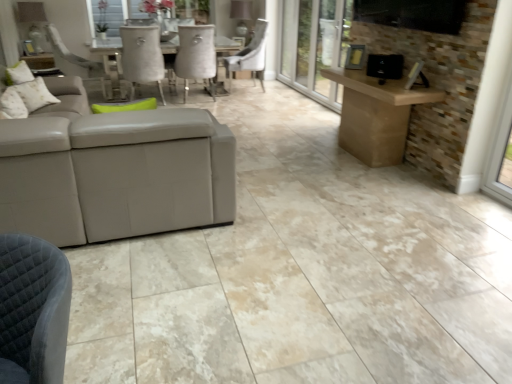
Question: Considering the relative sizes of white leather chair at center, which is the 2th chair in left-to-right order, and transparent glass screen door at center in the image provided, is white leather chair at center, which is the 2th chair in left-to-right order, shorter than transparent glass screen door at center?

Choices:
 (A) no
 (B) yes

Answer: (B)

Question: Would you say white leather chair at center, which is the 2th chair in left-to-right order, contains transparent glass screen door at center?

Choices:
 (A) yes
 (B) no

Answer: (B)

Question: Is white leather chair at center, which appears as the 1th chair when viewed from the right, facing away from transparent glass screen door at center?

Choices:
 (A) no
 (B) yes

Answer: (B)

Question: From the image's perspective, does white leather chair at center, which is the 2th chair in left-to-right order, appear lower than transparent glass screen door at center?

Choices:
 (A) yes
 (B) no

Answer: (A)

Question: Would you consider white leather chair at center, which appears as the 1th chair when viewed from the right, to be distant from transparent glass screen door at center?

Choices:
 (A) yes
 (B) no

Answer: (A)

Question: Looking at the image, does white fabric pillow at upper left, which is the second pillow in front-to-back order, seem bigger or smaller compared to fluffy white pillow at upper left, arranged as the first pillow when viewed from the right?

Choices:
 (A) big
 (B) small

Answer: (A)

Question: Relative to fluffy white pillow at upper left, arranged as the first pillow when viewed from the right, is white fabric pillow at upper left, which ranks as the 1th pillow in back-to-front order, in front or behind?

Choices:
 (A) front
 (B) behind

Answer: (B)

Question: Looking at their shapes, would you say white fabric pillow at upper left, acting as the 1th pillow starting from the left, is wider or thinner than fluffy white pillow at upper left, acting as the 1th pillow starting from the front?

Choices:
 (A) thin
 (B) wide

Answer: (B)

Question: Is point (36, 82) closer or farther from the camera than point (18, 104)?

Choices:
 (A) closer
 (B) farther

Answer: (B)

Question: From the image's perspective, is white fabric pillow at upper left, which ranks as the 1th pillow in back-to-front order, located above or below suede-like beige chair at center, the second chair when ordered from right to left?

Choices:
 (A) above
 (B) below

Answer: (B)

Question: In terms of size, does white fabric pillow at upper left, acting as the 1th pillow starting from the left, appear bigger or smaller than suede-like beige chair at center, which is the first chair from left to right?

Choices:
 (A) small
 (B) big

Answer: (A)

Question: Is white fabric pillow at upper left, which is the second pillow in front-to-back order, spatially inside suede-like beige chair at center, the second chair when ordered from right to left, or outside of it?

Choices:
 (A) inside
 (B) outside

Answer: (B)

Question: From a real-world perspective, is white fabric pillow at upper left, which is the second pillow in front-to-back order, physically located above or below suede-like beige chair at center, the second chair when ordered from right to left?

Choices:
 (A) above
 (B) below

Answer: (A)

Question: Is point (211, 39) closer or farther from the camera than point (15, 110)?

Choices:
 (A) farther
 (B) closer

Answer: (A)

Question: Is suede-like beige chair at center, the second chair when ordered from right to left, wider or thinner than fluffy white pillow at upper left, acting as the 1th pillow starting from the front?

Choices:
 (A) thin
 (B) wide

Answer: (B)